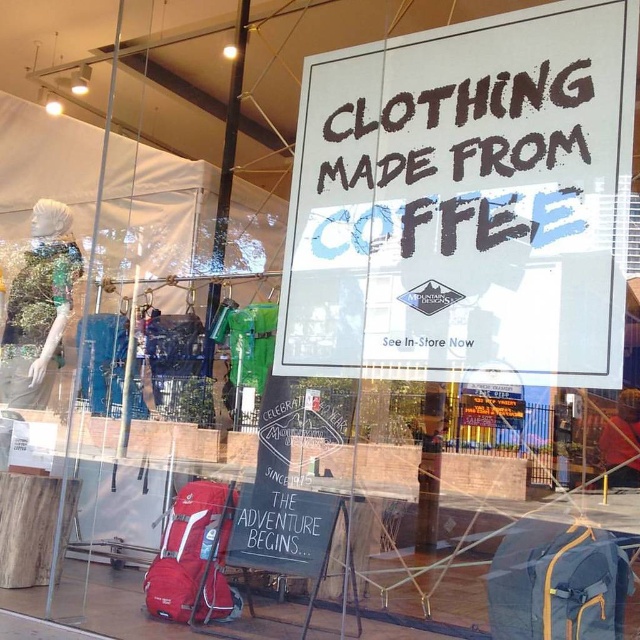
Question: Is white paper sign at center wider than matte red backpack at lower left?

Choices:
 (A) yes
 (B) no

Answer: (A)

Question: Can you confirm if white paper sign at center is bigger than matte red backpack at lower left?

Choices:
 (A) no
 (B) yes

Answer: (B)

Question: Can you confirm if white paper sign at center is wider than matte red backpack at lower left?

Choices:
 (A) no
 (B) yes

Answer: (B)

Question: Based on their relative distances, which object is nearer to the matte blue backpack at lower right?

Choices:
 (A) white paper sign at center
 (B) matte red backpack at lower left

Answer: (A)

Question: Among these objects, which one is farthest from the camera?

Choices:
 (A) matte blue backpack at lower right
 (B) white paper sign at center

Answer: (A)

Question: Among these objects, which one is nearest to the camera?

Choices:
 (A) matte blue backpack at lower right
 (B) white paper sign at center

Answer: (B)